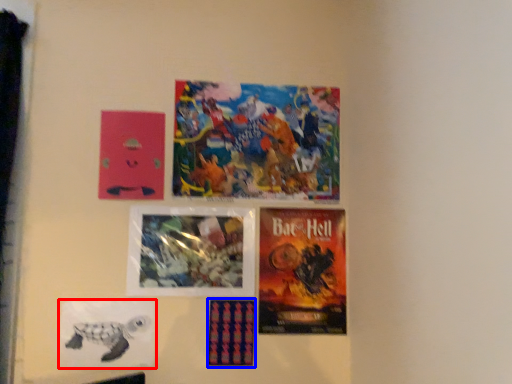
Question: Which object is closer to the camera taking this photo, poster (highlighted by a red box) or poster (highlighted by a blue box)?

Choices:
 (A) poster
 (B) poster

Answer: (A)